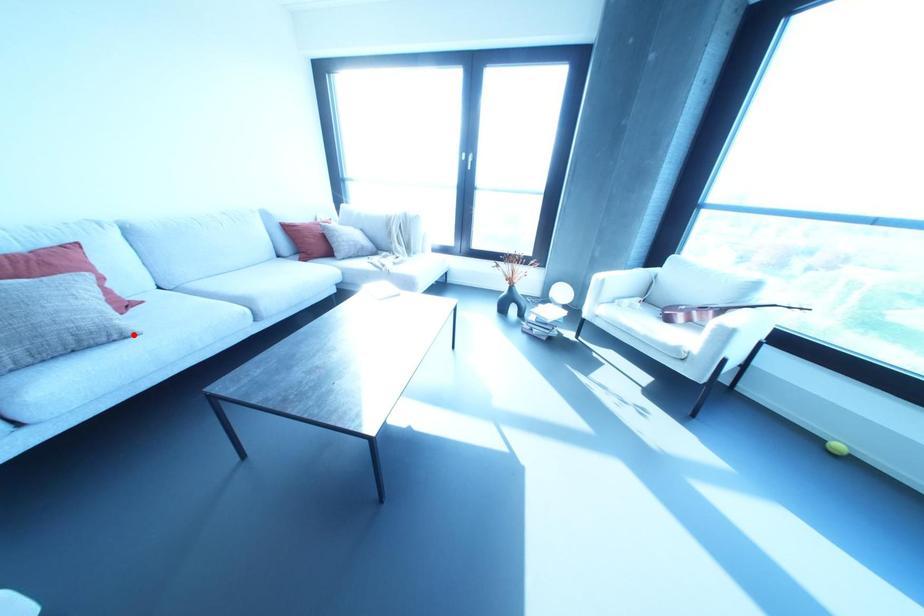
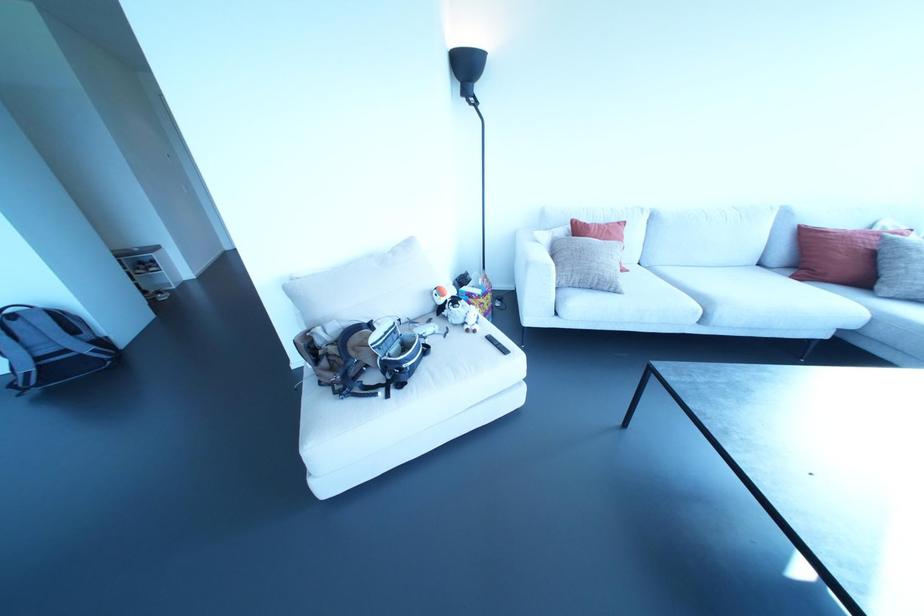
The point at the highlighted location is marked in the first image. Where is the corresponding point in the second image?

(618, 293)